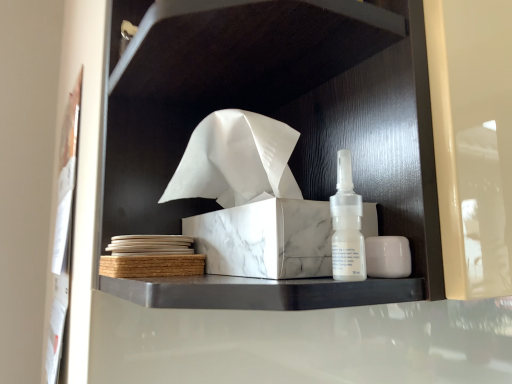
Measure the distance between white marble tissue box at center and camera.

white marble tissue box at center is 11.96 inches away from camera.

Locate an element on the screen. The height and width of the screenshot is (384, 512). white marble tissue box at center is located at coordinates (288, 144).

This screenshot has width=512, height=384. What do you see at coordinates (288, 144) in the screenshot? I see `white marble tissue box at center` at bounding box center [288, 144].

Locate an element on the screen. The width and height of the screenshot is (512, 384). white marble tissue box at center is located at coordinates (288, 144).